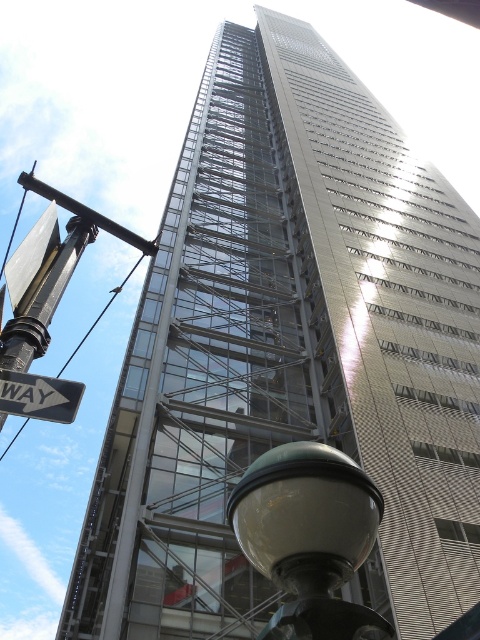
Consider the image. You are driving a car and see the matte glass street light at lower center and the black plastic street sign at left. Which object is closer to your car?

The matte glass street light at lower center is closer to your car because it is in front of the black plastic street sign at left.

You are a delivery drone flying over the skyscraper. You need to land at a specific coordinate. Where is the matte glass street light at lower center located?

The matte glass street light at lower center is located at point (309, 536).